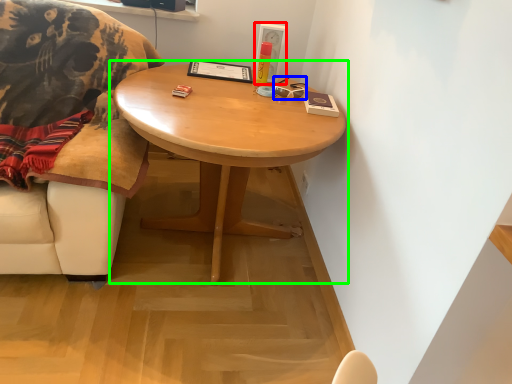
Question: Which object is the closest to the picture frame (highlighted by a red box)? Choose among these: glasses (highlighted by a blue box) or coffee table (highlighted by a green box).

Choices:
 (A) glasses
 (B) coffee table

Answer: (A)